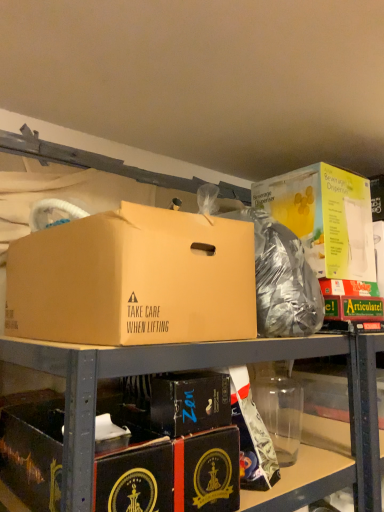
You are a GUI agent. You are given a task and a screenshot of the screen. Output one action in this format:
    pyautogui.click(x=<x>, y=<y>)
    Task: Click on the yellow cardboard beverage dispenser at upper right, which ranks as the first box in top-to-bottom order
    The image size is (384, 512).
    Given the screenshot: What is the action you would take?
    pyautogui.click(x=324, y=218)

Measure the distance between point (x=20, y=430) and camera.

The distance of point (x=20, y=430) from camera is 38.58 inches.

Locate an element on the screen. This screenshot has width=384, height=512. shiny metallic bag at center is located at coordinates (282, 279).

Where is `brown cardboard box at center, the second box from the top`? The width and height of the screenshot is (384, 512). brown cardboard box at center, the second box from the top is located at coordinates pyautogui.click(x=133, y=280).

Measure the distance between brown cardboard box at center, the second box from the top, and camera.

brown cardboard box at center, the second box from the top, is 30.67 inches away from camera.

Locate an element on the screen. This screenshot has height=512, width=384. yellow cardboard beverage dispenser at upper right, which ranks as the first box in top-to-bottom order is located at coordinates (324, 218).

From the image's perspective, is yellow cardboard beverage dispenser at upper right, which ranks as the first box in top-to-bottom order, under brown cardboard box at center, the second box from the top?

Incorrect, from the image's perspective, yellow cardboard beverage dispenser at upper right, which ranks as the first box in top-to-bottom order, is higher than brown cardboard box at center, the second box from the top.

Which is behind, yellow cardboard beverage dispenser at upper right, the 4th box from the bottom, or brown cardboard box at center, positioned as the third box in bottom-to-top order?

Positioned behind is yellow cardboard beverage dispenser at upper right, the 4th box from the bottom.

Is yellow cardboard beverage dispenser at upper right, the 4th box from the bottom, in contact with brown cardboard box at center, positioned as the third box in bottom-to-top order?

No, yellow cardboard beverage dispenser at upper right, the 4th box from the bottom, is not making contact with brown cardboard box at center, positioned as the third box in bottom-to-top order.

Is yellow cardboard beverage dispenser at upper right, which ranks as the first box in top-to-bottom order, spatially inside brown cardboard box at center, the second box from the top, or outside of it?

yellow cardboard beverage dispenser at upper right, which ranks as the first box in top-to-bottom order, is spatially situated outside brown cardboard box at center, the second box from the top.

Which is further, (198, 389) or (291, 221)?

Positioned behind is point (291, 221).

From a real-world perspective, which is physically above, black cardboard box at center, which ranks as the second box in bottom-to-top order, or yellow cardboard beverage dispenser at upper right, the 4th box from the bottom?

yellow cardboard beverage dispenser at upper right, the 4th box from the bottom, from a real-world perspective.

Is the depth of black cardboard box at center, acting as the third box starting from the top, less than that of yellow cardboard beverage dispenser at upper right, which ranks as the first box in top-to-bottom order?

Yes, it is in front of yellow cardboard beverage dispenser at upper right, which ranks as the first box in top-to-bottom order.

Which of these two, black cardboard box at center, which ranks as the second box in bottom-to-top order, or yellow cardboard beverage dispenser at upper right, which ranks as the first box in top-to-bottom order, is wider?

yellow cardboard beverage dispenser at upper right, which ranks as the first box in top-to-bottom order.

From the image's perspective, between black cardboard box at lower left, marked as the first box in a bottom-to-top arrangement, and yellow cardboard beverage dispenser at upper right, which ranks as the first box in top-to-bottom order, which one is located above?

yellow cardboard beverage dispenser at upper right, which ranks as the first box in top-to-bottom order, from the image's perspective.

Is black cardboard box at lower left, marked as the first box in a bottom-to-top arrangement, inside the boundaries of yellow cardboard beverage dispenser at upper right, the 4th box from the bottom, or outside?

black cardboard box at lower left, marked as the first box in a bottom-to-top arrangement, is not inside yellow cardboard beverage dispenser at upper right, the 4th box from the bottom, it's outside.

Is the surface of black cardboard box at lower left, marked as the first box in a bottom-to-top arrangement, in direct contact with yellow cardboard beverage dispenser at upper right, which ranks as the first box in top-to-bottom order?

No, black cardboard box at lower left, marked as the first box in a bottom-to-top arrangement, is not touching yellow cardboard beverage dispenser at upper right, which ranks as the first box in top-to-bottom order.

Consider the image. From a real-world perspective, is black cardboard box at lower left, marked as the first box in a bottom-to-top arrangement, over yellow cardboard beverage dispenser at upper right, the 4th box from the bottom?

Incorrect, from a real-world perspective, black cardboard box at lower left, marked as the first box in a bottom-to-top arrangement, is lower than yellow cardboard beverage dispenser at upper right, the 4th box from the bottom.

Measure the distance from brown cardboard box at center, the second box from the top, to black cardboard box at lower left, which is the 4th box from top to bottom.

brown cardboard box at center, the second box from the top, is 11.33 inches away from black cardboard box at lower left, which is the 4th box from top to bottom.

Based on the photo, is black cardboard box at lower left, marked as the first box in a bottom-to-top arrangement, a part of brown cardboard box at center, the second box from the top?

That's incorrect, black cardboard box at lower left, marked as the first box in a bottom-to-top arrangement, is not inside brown cardboard box at center, the second box from the top.

Considering the relative positions of brown cardboard box at center, positioned as the third box in bottom-to-top order, and black cardboard box at lower left, which is the 4th box from top to bottom, in the image provided, is brown cardboard box at center, positioned as the third box in bottom-to-top order, behind black cardboard box at lower left, which is the 4th box from top to bottom,?

No, it is not.

From the picture: Does brown cardboard box at center, the second box from the top, appear on the left side of black cardboard box at lower left, marked as the first box in a bottom-to-top arrangement?

Incorrect, brown cardboard box at center, the second box from the top, is not on the left side of black cardboard box at lower left, marked as the first box in a bottom-to-top arrangement.

Is black cardboard box at lower left, which is the 4th box from top to bottom, far from brown cardboard box at center, positioned as the third box in bottom-to-top order?

No, black cardboard box at lower left, which is the 4th box from top to bottom, is not far away from brown cardboard box at center, positioned as the third box in bottom-to-top order.

Who is smaller, black cardboard box at lower left, which is the 4th box from top to bottom, or brown cardboard box at center, positioned as the third box in bottom-to-top order?

black cardboard box at lower left, which is the 4th box from top to bottom.

Is brown cardboard box at center, positioned as the third box in bottom-to-top order, a part of black cardboard box at lower left, marked as the first box in a bottom-to-top arrangement?

Actually, brown cardboard box at center, positioned as the third box in bottom-to-top order, is outside black cardboard box at lower left, marked as the first box in a bottom-to-top arrangement.

Is black cardboard box at lower left, which is the 4th box from top to bottom, in front of or behind brown cardboard box at center, positioned as the third box in bottom-to-top order, in the image?

Visually, black cardboard box at lower left, which is the 4th box from top to bottom, is located behind brown cardboard box at center, positioned as the third box in bottom-to-top order.

Which object is further away from the camera taking this photo, shiny metallic bag at center or black cardboard box at center, which ranks as the second box in bottom-to-top order?

shiny metallic bag at center is further from the camera.

Is black cardboard box at center, which ranks as the second box in bottom-to-top order, located within shiny metallic bag at center?

No, black cardboard box at center, which ranks as the second box in bottom-to-top order, is not a part of shiny metallic bag at center.

Is shiny metallic bag at center aimed at black cardboard box at center, which ranks as the second box in bottom-to-top order?

No, shiny metallic bag at center is not aimed at black cardboard box at center, which ranks as the second box in bottom-to-top order.

Is brown cardboard box at center, positioned as the third box in bottom-to-top order, positioned beyond the bounds of yellow cardboard beverage dispenser at upper right, the 4th box from the bottom?

Absolutely, brown cardboard box at center, positioned as the third box in bottom-to-top order, is external to yellow cardboard beverage dispenser at upper right, the 4th box from the bottom.

Considering the relative sizes of brown cardboard box at center, positioned as the third box in bottom-to-top order, and yellow cardboard beverage dispenser at upper right, which ranks as the first box in top-to-bottom order, in the image provided, is brown cardboard box at center, positioned as the third box in bottom-to-top order, wider than yellow cardboard beverage dispenser at upper right, which ranks as the first box in top-to-bottom order,?

Correct, the width of brown cardboard box at center, positioned as the third box in bottom-to-top order, exceeds that of yellow cardboard beverage dispenser at upper right, which ranks as the first box in top-to-bottom order.

Can you see brown cardboard box at center, positioned as the third box in bottom-to-top order, touching yellow cardboard beverage dispenser at upper right, which ranks as the first box in top-to-bottom order?

No, brown cardboard box at center, positioned as the third box in bottom-to-top order, is not with yellow cardboard beverage dispenser at upper right, which ranks as the first box in top-to-bottom order.

Considering the positions of objects brown cardboard box at center, positioned as the third box in bottom-to-top order, and yellow cardboard beverage dispenser at upper right, which ranks as the first box in top-to-bottom order, in the image provided, who is more to the left, brown cardboard box at center, positioned as the third box in bottom-to-top order, or yellow cardboard beverage dispenser at upper right, which ranks as the first box in top-to-bottom order,?

From the viewer's perspective, brown cardboard box at center, positioned as the third box in bottom-to-top order, appears more on the left side.

The image size is (384, 512). Find the location of `box lying above the brown cardboard box at center, the second box from the top (from the image's perspective)`. box lying above the brown cardboard box at center, the second box from the top (from the image's perspective) is located at coordinates (324, 218).

Locate an element on the screen. Image resolution: width=384 pixels, height=512 pixels. the 2nd box below when counting from the yellow cardboard beverage dispenser at upper right, the 4th box from the bottom (from the image's perspective) is located at coordinates pos(177,401).

Based on the photo, from the image, which object appears to be nearer to yellow cardboard beverage dispenser at upper right, which ranks as the first box in top-to-bottom order, black cardboard box at lower left, which is the 4th box from top to bottom, or black cardboard box at center, which ranks as the second box in bottom-to-top order?

black cardboard box at center, which ranks as the second box in bottom-to-top order, is positioned closer to the anchor yellow cardboard beverage dispenser at upper right, which ranks as the first box in top-to-bottom order.

Looking at the image, which one is located closer to yellow cardboard beverage dispenser at upper right, the 4th box from the bottom, shiny metallic bag at center or black cardboard box at lower left, marked as the first box in a bottom-to-top arrangement?

shiny metallic bag at center is closer to yellow cardboard beverage dispenser at upper right, the 4th box from the bottom.

Looking at the image, which one is located closer to black cardboard box at lower left, marked as the first box in a bottom-to-top arrangement, shiny metallic bag at center or brown cardboard box at center, the second box from the top?

brown cardboard box at center, the second box from the top.

From the image, which object appears to be farther from yellow cardboard beverage dispenser at upper right, the 4th box from the bottom, black cardboard box at center, which ranks as the second box in bottom-to-top order, or shiny metallic bag at center?

black cardboard box at center, which ranks as the second box in bottom-to-top order, is further to yellow cardboard beverage dispenser at upper right, the 4th box from the bottom.

Considering their positions, is brown cardboard box at center, the second box from the top, positioned further to black cardboard box at lower left, which is the 4th box from top to bottom, than yellow cardboard beverage dispenser at upper right, which ranks as the first box in top-to-bottom order?

The object further to black cardboard box at lower left, which is the 4th box from top to bottom, is yellow cardboard beverage dispenser at upper right, which ranks as the first box in top-to-bottom order.

From the image, which object appears to be nearer to shiny metallic bag at center, black cardboard box at lower left, which is the 4th box from top to bottom, or black cardboard box at center, acting as the third box starting from the top?

black cardboard box at center, acting as the third box starting from the top.

Looking at the image, which one is located further to black cardboard box at center, which ranks as the second box in bottom-to-top order, brown cardboard box at center, the second box from the top, or yellow cardboard beverage dispenser at upper right, which ranks as the first box in top-to-bottom order?

Based on the image, yellow cardboard beverage dispenser at upper right, which ranks as the first box in top-to-bottom order, appears to be further to black cardboard box at center, which ranks as the second box in bottom-to-top order.

When comparing their distances from black cardboard box at center, which ranks as the second box in bottom-to-top order, does yellow cardboard beverage dispenser at upper right, which ranks as the first box in top-to-bottom order, or black cardboard box at lower left, marked as the first box in a bottom-to-top arrangement, seem further?

Answer: yellow cardboard beverage dispenser at upper right, which ranks as the first box in top-to-bottom order.

Locate an element on the screen. garbage between brown cardboard box at center, the second box from the top, and yellow cardboard beverage dispenser at upper right, which ranks as the first box in top-to-bottom order, in the front-back direction is located at coordinates (282, 279).

Identify the location of box between brown cardboard box at center, positioned as the third box in bottom-to-top order, and shiny metallic bag at center from left to right. The height and width of the screenshot is (512, 384). (177, 401).

This screenshot has height=512, width=384. I want to click on box between brown cardboard box at center, positioned as the third box in bottom-to-top order, and black cardboard box at lower left, marked as the first box in a bottom-to-top arrangement, vertically, so (177, 401).

The width and height of the screenshot is (384, 512). Identify the location of garbage between black cardboard box at lower left, marked as the first box in a bottom-to-top arrangement, and yellow cardboard beverage dispenser at upper right, the 4th box from the bottom, from left to right. tap(282, 279).